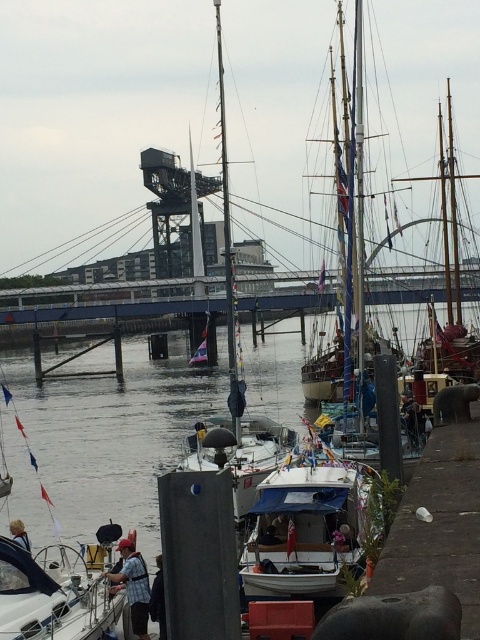
Between metallic gray bridge at center and wooden sailboat at center, which one is positioned lower?

metallic gray bridge at center

Is point (265, 298) closer to viewer compared to point (356, 17)?

No, it is not.

Which is behind, point (12, 321) or point (343, 365)?

Positioned behind is point (12, 321).

Where is `metallic gray bridge at center`? metallic gray bridge at center is located at coordinates (108, 301).

Is point (310, 573) less distant than point (49, 579)?

No, it is behind (49, 579).

Is white matte boat at center to the right of white glossy sailboat at lower left from the viewer's perspective?

Correct, you'll find white matte boat at center to the right of white glossy sailboat at lower left.

Is point (286, 484) less distant than point (36, 573)?

That is False.

Where is `white matte boat at center`? white matte boat at center is located at coordinates (307, 525).

Does white matte boat at center appear over metallic gray bridge at center?

No.

Image resolution: width=480 pixels, height=640 pixels. What do you see at coordinates (307, 525) in the screenshot?
I see `white matte boat at center` at bounding box center [307, 525].

Who is more forward, (335, 541) or (269, 292)?

Point (335, 541)

This screenshot has height=640, width=480. Identify the location of white matte boat at center. (307, 525).